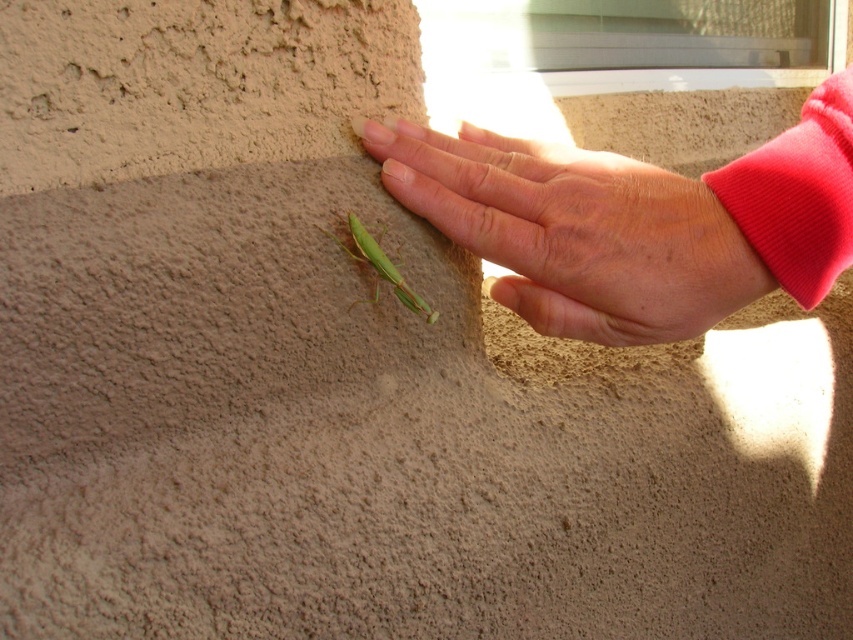
You are a biologist observing an insect. You see a smooth skin hand at center and a green matte insect at center. Which object is taller?

The smooth skin hand at center is taller than the green matte insect at center.

You are a photographer trying to capture the green matte insect at center without the smooth skin hand at center blocking the view. Based on their positions, can you position yourself to the left or right side of the scene to ensure the insect is visible?

The smooth skin hand at center is to the right of the green matte insect at center. To avoid blocking the view, you should position yourself to the right side of the scene so that the hand is between you and the insect, but since the hand is already to the right of the insect, positioning to the left would keep the hand out of the way, allowing the insect to be visible.